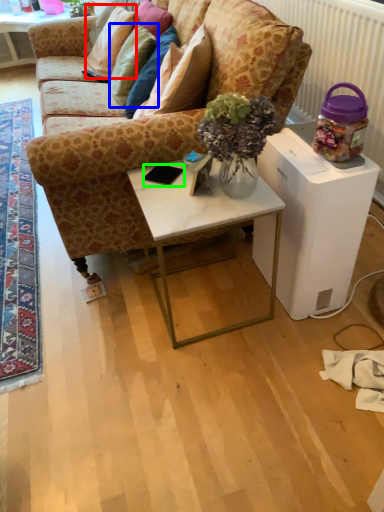
Question: Which is nearer to the pillow (highlighted by a red box)? pillow (highlighted by a blue box) or mobile phone (highlighted by a green box).

Choices:
 (A) pillow
 (B) mobile phone

Answer: (A)